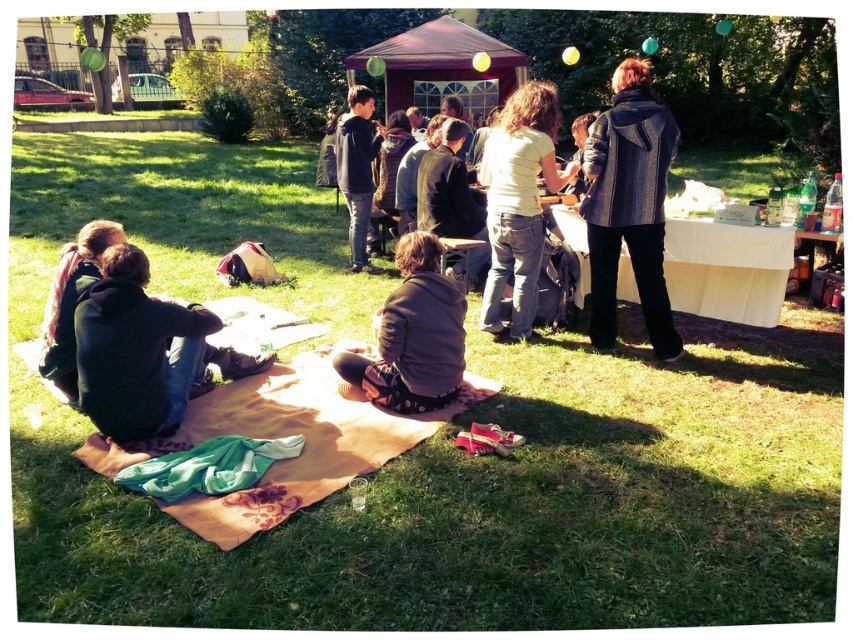
Question: Which of the following is the closest to the observer?

Choices:
 (A) (532, 81)
 (B) (119, 362)

Answer: (B)

Question: Which object appears farthest from the camera in this image?

Choices:
 (A) beige floral blanket at lower center
 (B) dark brown sweater at lower left
 (C) white matte shirt at center
 (D) dark blue hoodie at center

Answer: (D)

Question: Does beige floral blanket at lower center appear on the left side of brown fuzzy jacket at center?

Choices:
 (A) yes
 (B) no

Answer: (A)

Question: Does dark gray hoodie at lower left lie in front of dark brown sweater at lower left?

Choices:
 (A) no
 (B) yes

Answer: (B)

Question: Which of these objects is positioned closest to the beige floral blanket at lower center?

Choices:
 (A) textured gray coat at right
 (B) dark gray hoodie at lower left

Answer: (B)

Question: Is beige floral blanket at lower center thinner than brown fuzzy jacket at center?

Choices:
 (A) no
 (B) yes

Answer: (A)